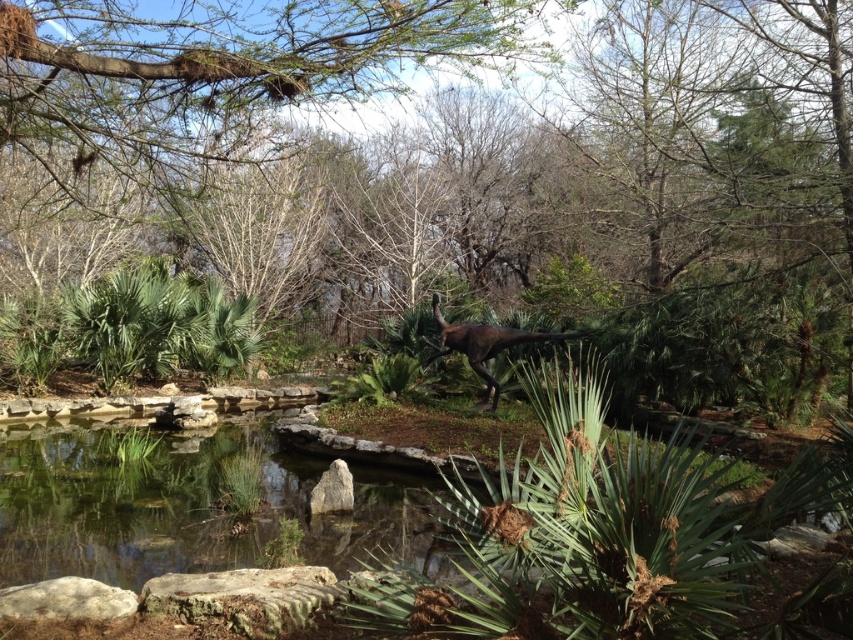
Question: Which object appears farthest from the camera in this image?

Choices:
 (A) gray rough rock at lower left
 (B) clear water at pond center
 (C) green leafy tree at center
 (D) gray rough rock at center

Answer: (B)

Question: Can you confirm if gray rough rock at lower left is smaller than shiny brown dinosaur at center?

Choices:
 (A) no
 (B) yes

Answer: (B)

Question: Among these points, which one is nearest to the camera?

Choices:
 (A) (97, 605)
 (B) (477, 339)
 (C) (202, 102)

Answer: (A)

Question: Does green leafy tree at center appear on the left side of clear water at pond center?

Choices:
 (A) no
 (B) yes

Answer: (A)

Question: Which object is closer to the camera taking this photo?

Choices:
 (A) gray rough rock at center
 (B) gray rough rock at lower left
 (C) clear water at pond center

Answer: (B)

Question: Can you confirm if clear water at pond center is thinner than gray rough rock at lower left?

Choices:
 (A) yes
 (B) no

Answer: (A)